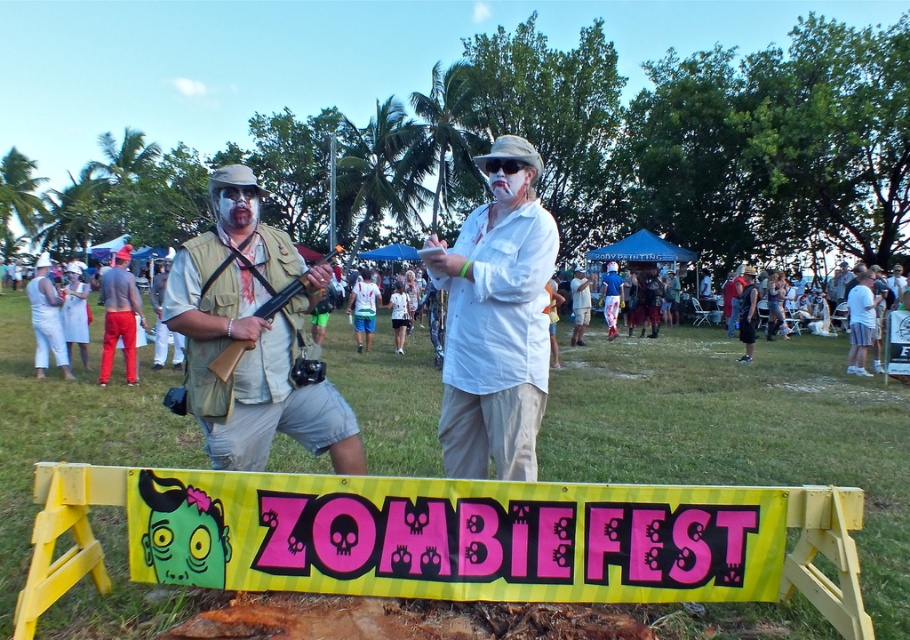
You are a photographer at the Zombie Fest and want to capture the red cotton shorts at center and the yellow plastic banner at center in the same frame. Based on their positions, which object should you adjust your camera to focus on first to ensure both are in the shot?

The yellow plastic banner at center is to the right of the red cotton shorts at center, so you should focus on the red cotton shorts at center first as it is on the left side to include both in the frame.

You are a photographer at the Zombie Fest event. You need to capture a photo where the white matte shirt at center is visible without being blocked by the yellow plastic banner at center. Based on the scene description, is this possible?

Yes, the white matte shirt at center is above the yellow plastic banner at center, so it will not be blocked by the banner and can be clearly seen in the photo.

You are a photographer standing at the edge of the Zombie Fest event. You need to capture a photo of the white matte shirt at center and the yellow plastic banner at center in the same frame. Considering your camera has a minimum focus distance of 1.5 meters, will you be able to take the photo without moving closer?

The distance between the white matte shirt at center and the yellow plastic banner at center is 1.40 meters. Since the camera requires a minimum focus distance of 1.5 meters, the photographer will need to move closer to ensure both objects are in focus.